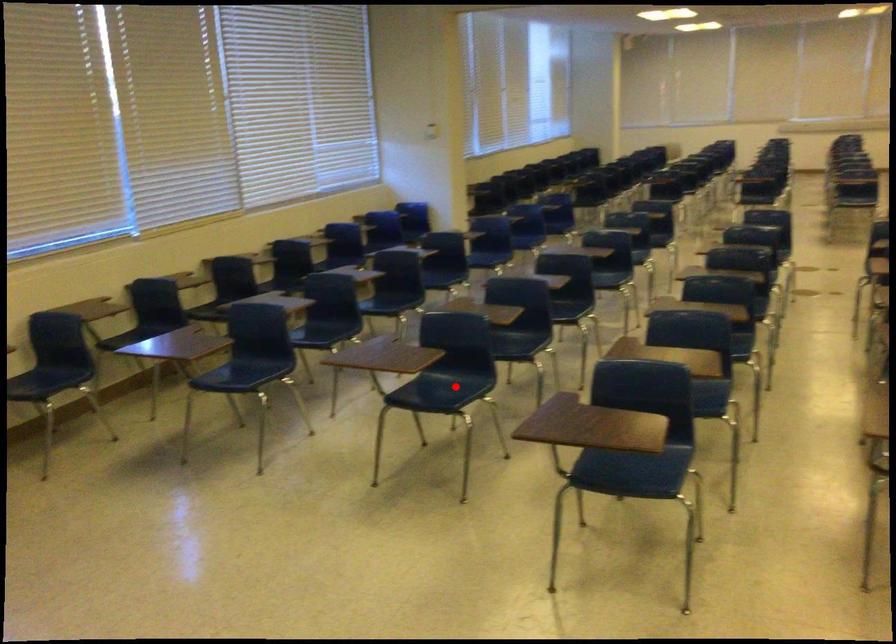
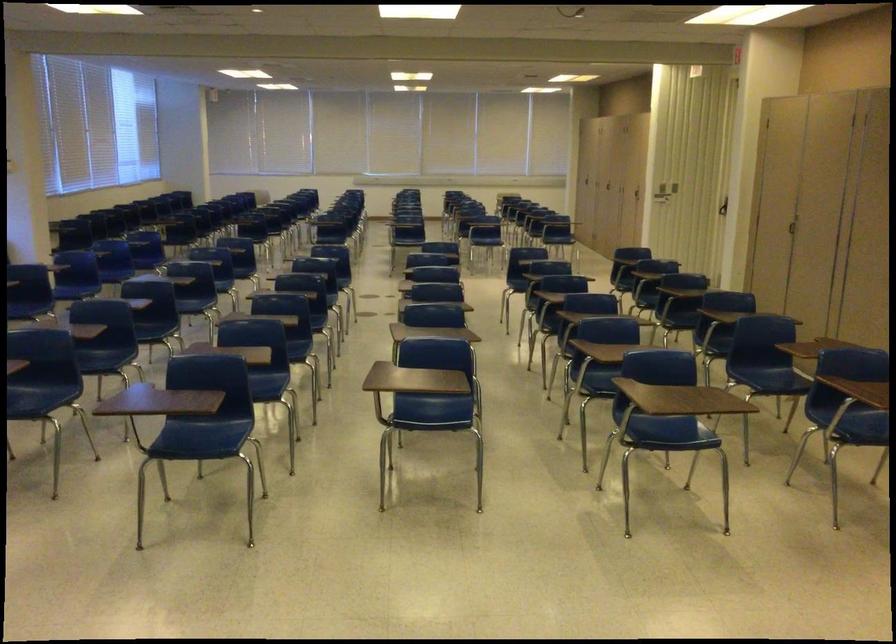
Locate, in the second image, the point that corresponds to the highlighted location in the first image.

(39, 395)